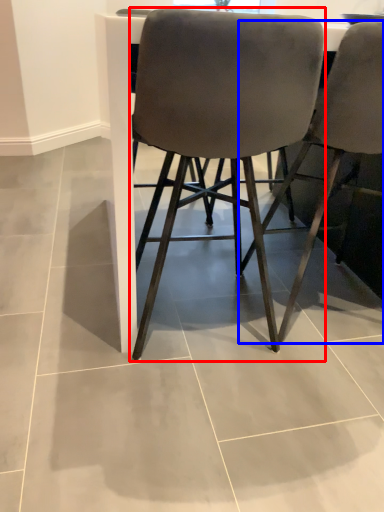
Question: Among these objects, which one is nearest to the camera, chair (highlighted by a red box) or chair (highlighted by a blue box)?

Choices:
 (A) chair
 (B) chair

Answer: (A)